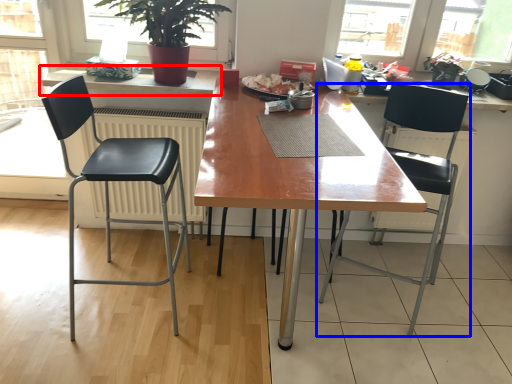
Question: Which object is further to the camera taking this photo, counter top (highlighted by a red box) or chair (highlighted by a blue box)?

Choices:
 (A) counter top
 (B) chair

Answer: (A)